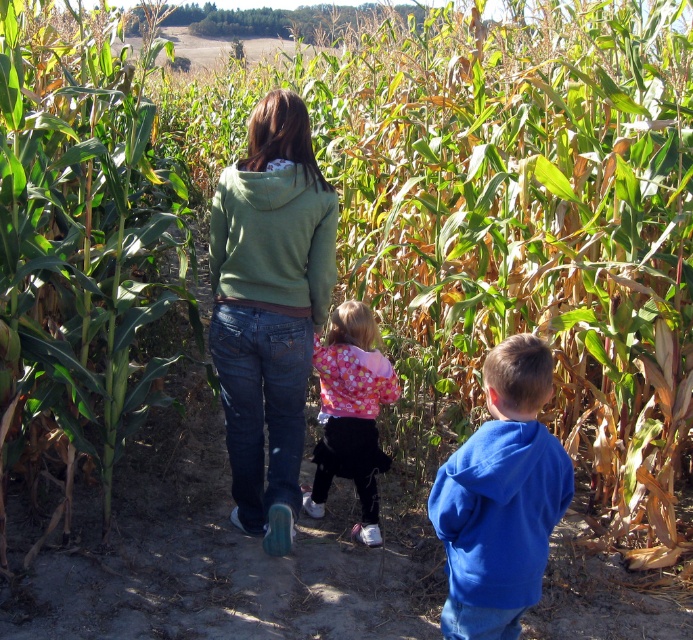
Consider the image. You are part of a group navigating a corn maze. You notice two people ahead of you wearing a blue fleece jacket at center and a fluffy pink sweater at center. Which one of them is closer to you?

The blue fleece jacket at center is smaller than the fluffy pink sweater at center, so the person wearing the blue fleece jacket at center is closer to you.

You are a tour guide in the corn maze. You see the green matte hoodie at center and the young child in pink and white pattern to the right. You need to walk to the exit which is 5 meters ahead. Can you walk straight ahead without worrying about bumping into either of them?

The green matte hoodie at center and the young child in pink and white pattern to the right are 3.59 meters apart. Since the exit is 5 meters ahead, you can walk straight ahead without worrying about bumping into them as the distance between them is sufficient.